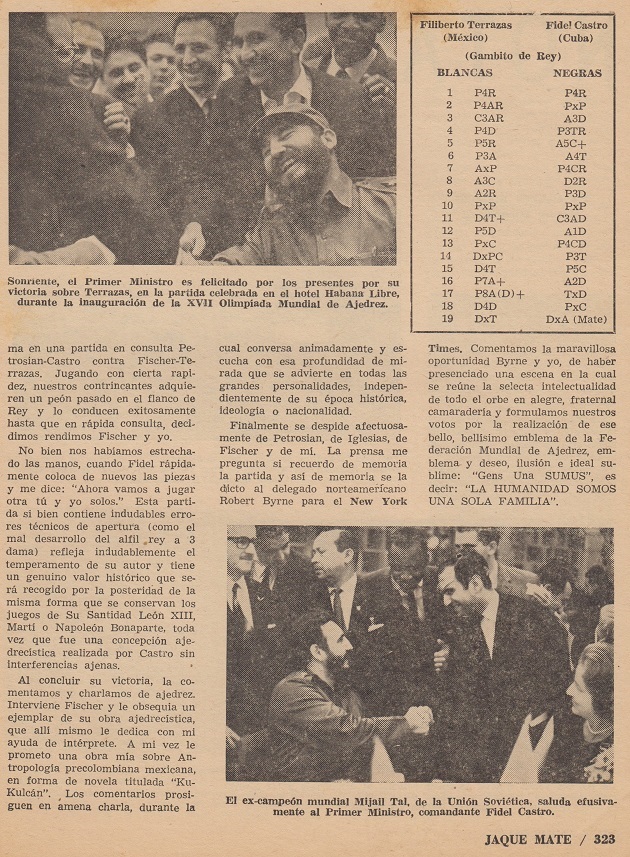
Image resolution: width=630 pixels, height=857 pixels. I want to click on newspaper, so click(x=411, y=162).